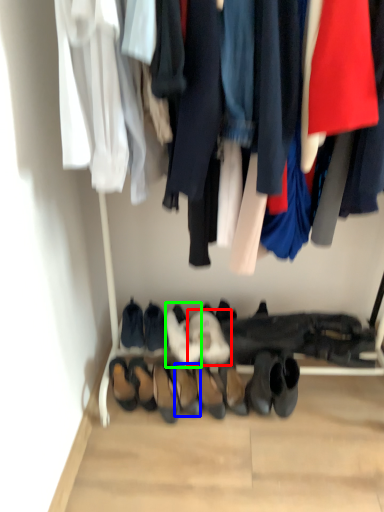
Question: Considering the real-world distances, which object is farthest from footwear (highlighted by a red box)? footwear (highlighted by a blue box) or footwear (highlighted by a green box)?

Choices:
 (A) footwear
 (B) footwear

Answer: (A)